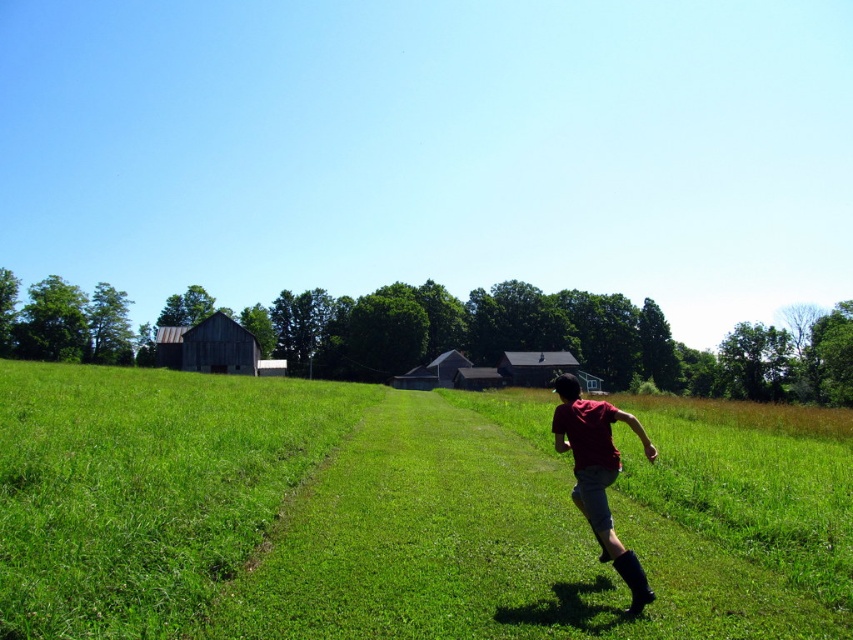
Question: Can you confirm if green grassy field at center is wider than red matte shirt at center?

Choices:
 (A) no
 (B) yes

Answer: (B)

Question: Among these points, which one is nearest to the camera?

Choices:
 (A) (618, 554)
 (B) (97, 436)

Answer: (A)

Question: Is green grassy field at center to the left of red matte shirt at center from the viewer's perspective?

Choices:
 (A) no
 (B) yes

Answer: (B)

Question: Observing the image, what is the correct spatial positioning of green grassy field at center in reference to red matte shirt at center?

Choices:
 (A) above
 (B) below

Answer: (B)